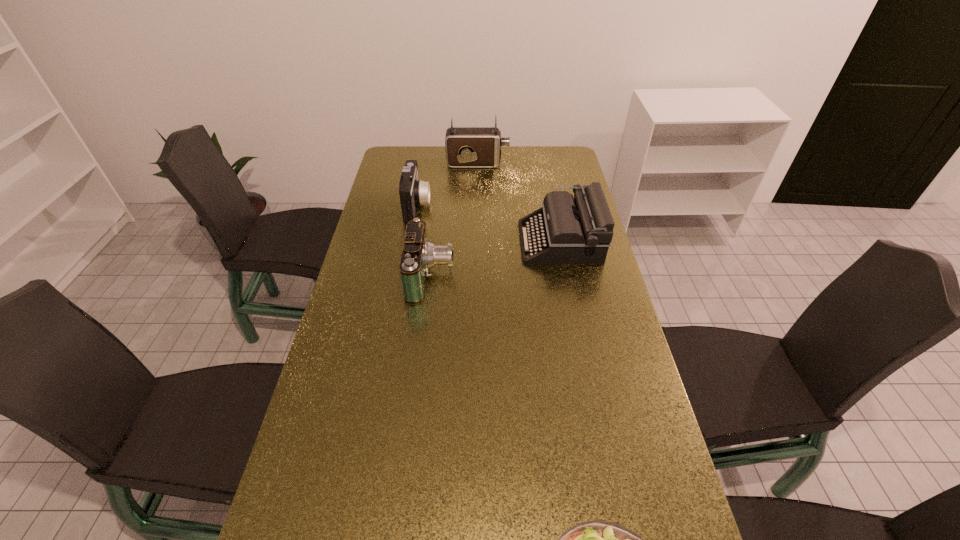
Where is `vacant space that is in between the second farthest camcorder and the typewriter`? vacant space that is in between the second farthest camcorder and the typewriter is located at coordinates click(x=489, y=223).

Select which object is the second closest to the second nearest camcorder. Please provide its 2D coordinates. Your answer should be formatted as a tuple, i.e. [(x, y)], where the tuple contains the x and y coordinates of a point satisfying the conditions above.

[(466, 147)]

Locate which object ranks third in proximity to the typewriter. Please provide its 2D coordinates. Your answer should be formatted as a tuple, i.e. [(x, y)], where the tuple contains the x and y coordinates of a point satisfying the conditions above.

[(466, 147)]

This screenshot has height=540, width=960. What are the coordinates of `the closest camcorder to the typewriter` in the screenshot? It's located at (419, 254).

The image size is (960, 540). I want to click on camcorder identified as the closest to the typewriter, so click(x=419, y=254).